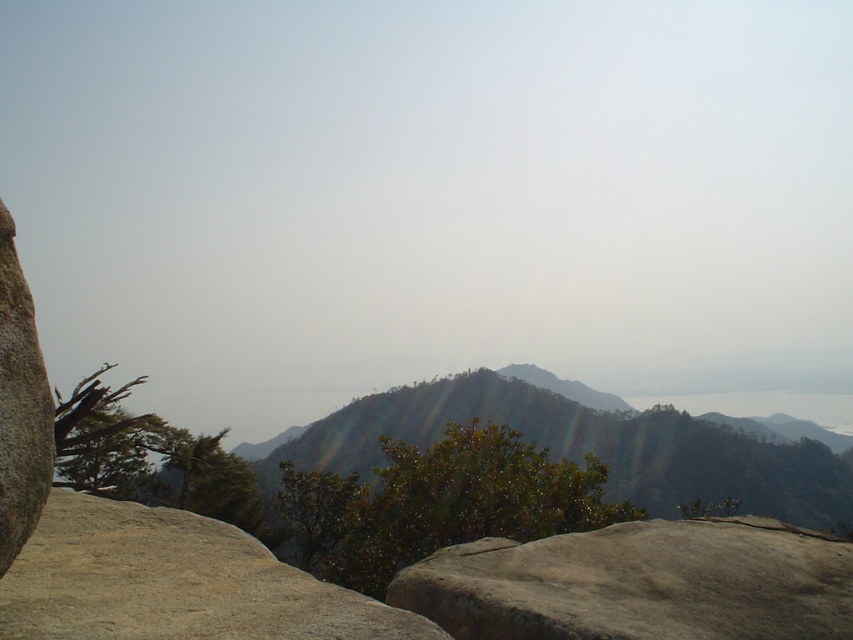
From the picture: You are standing at the top of the rocky outcrop and want to place a small flag exactly at the center of the smooth gray rock at center. Given that the image is displayed on a screen with a coordinate system where the bottom left corner is the origin, can you determine the exact coordinates where you should place the flag?

The smooth gray rock at center is located at coordinates point [639,582], so you should place the flag at those coordinates to mark its center.